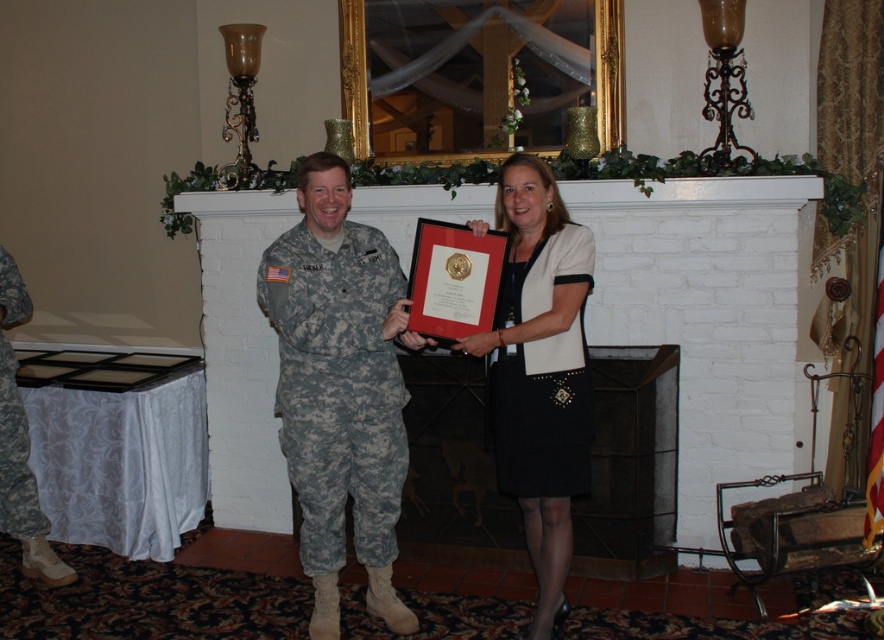
Is camouflage uniform at center above camouflage fabric uniform at left?

Indeed, camouflage uniform at center is positioned over camouflage fabric uniform at left.

Describe the element at coordinates (540, 376) in the screenshot. This screenshot has width=884, height=640. I see `camouflage uniform at center` at that location.

Image resolution: width=884 pixels, height=640 pixels. What do you see at coordinates (540, 376) in the screenshot? I see `camouflage uniform at center` at bounding box center [540, 376].

Locate an element on the screen. The image size is (884, 640). camouflage uniform at center is located at coordinates (540, 376).

Does camouflage fabric uniform at center appear over camouflage fabric uniform at left?

Indeed, camouflage fabric uniform at center is positioned over camouflage fabric uniform at left.

Identify the location of camouflage fabric uniform at center. (338, 388).

Is point (386, 426) less distant than point (13, 442)?

Yes, point (386, 426) is closer to viewer.

The image size is (884, 640). I want to click on camouflage fabric uniform at center, so click(338, 388).

Between camouflage uniform at center and camouflage fabric uniform at center, which one has less height?

Standing shorter between the two is camouflage fabric uniform at center.

Is camouflage uniform at center bigger than camouflage fabric uniform at center?

Correct, camouflage uniform at center is larger in size than camouflage fabric uniform at center.

Is point (547, 218) closer to camera compared to point (375, 284)?

That is True.

Locate an element on the screen. Image resolution: width=884 pixels, height=640 pixels. camouflage uniform at center is located at coordinates (540, 376).